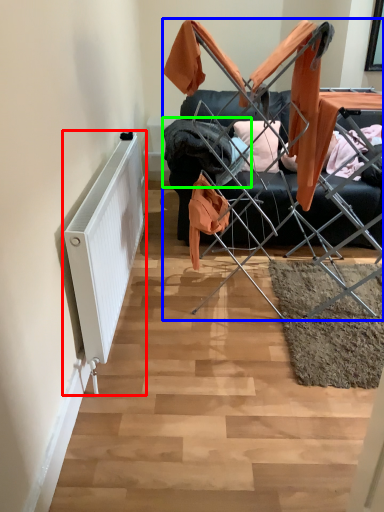
Question: Considering the real-world distances, which object is closest to radiator (highlighted by a red box)? furniture (highlighted by a blue box) or clothing (highlighted by a green box).

Choices:
 (A) furniture
 (B) clothing

Answer: (B)